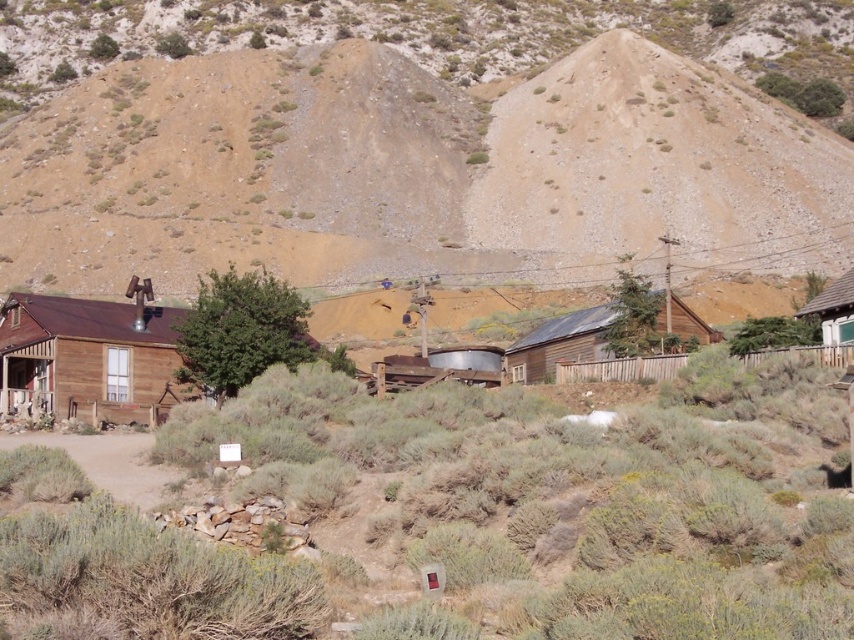
Question: Among these objects, which one is nearest to the camera?

Choices:
 (A) green leafy tree at center
 (B) brown wooden hut at center
 (C) green leafy bush at center

Answer: (C)

Question: Among these objects, which one is nearest to the camera?

Choices:
 (A) green leafy bush at center
 (B) brown wooden hut at left
 (C) wooden hut at right

Answer: (C)

Question: Is green leafy tree at center wider than wooden hut at right?

Choices:
 (A) yes
 (B) no

Answer: (B)

Question: Which point is closer to the camera taking this photo?

Choices:
 (A) (535, 328)
 (B) (851, 326)
 (C) (231, 122)

Answer: (B)

Question: Is brown dirt at upper center above green leafy tree at center?

Choices:
 (A) no
 (B) yes

Answer: (B)

Question: Does brown dirt at upper center appear under green leafy bush at upper right?

Choices:
 (A) yes
 (B) no

Answer: (B)